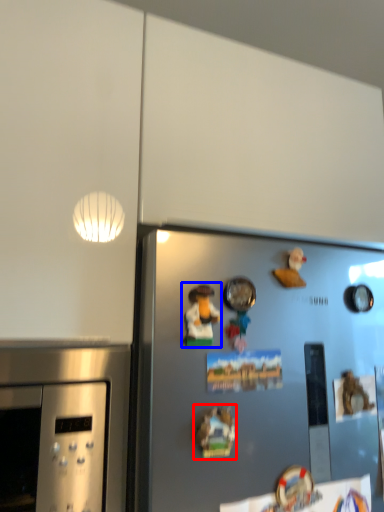
Question: Which of the following is the closest to the observer, art (highlighted by a red box) or art (highlighted by a blue box)?

Choices:
 (A) art
 (B) art

Answer: (A)